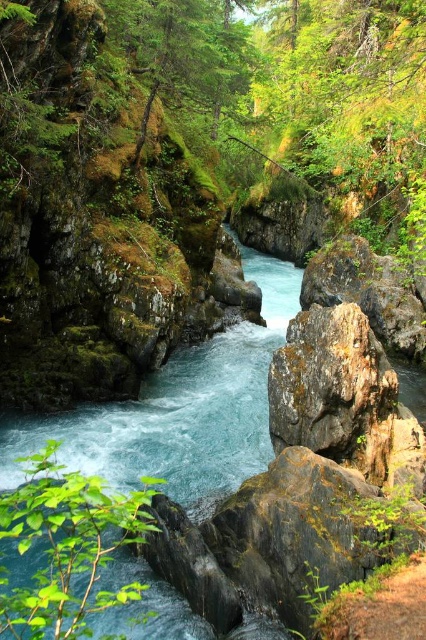
Question: Which of the following is the farthest from the observer?

Choices:
 (A) rusty stone boulder at center-right
 (B) green leafy branch at lower left

Answer: (A)

Question: Which of the following is the closest to the observer?

Choices:
 (A) green leafy branch at lower left
 (B) rusty stone boulder at center-right

Answer: (A)

Question: Can you confirm if green leafy branch at lower left is wider than rusty stone boulder at center-right?

Choices:
 (A) no
 (B) yes

Answer: (A)

Question: Is green leafy branch at lower left thinner than rusty stone boulder at center-right?

Choices:
 (A) yes
 (B) no

Answer: (A)

Question: Where is green leafy branch at lower left located in relation to rusty stone boulder at center-right in the image?

Choices:
 (A) left
 (B) right

Answer: (A)